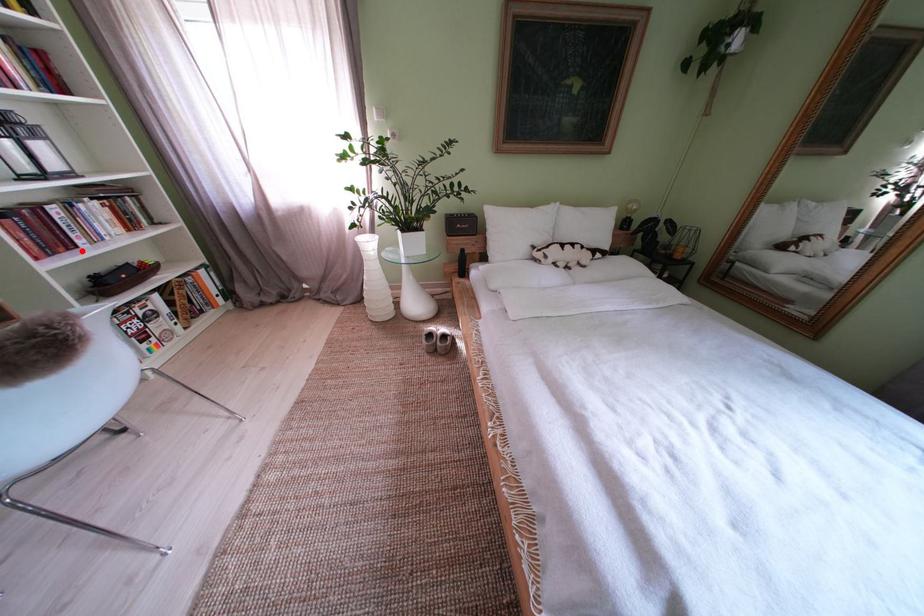
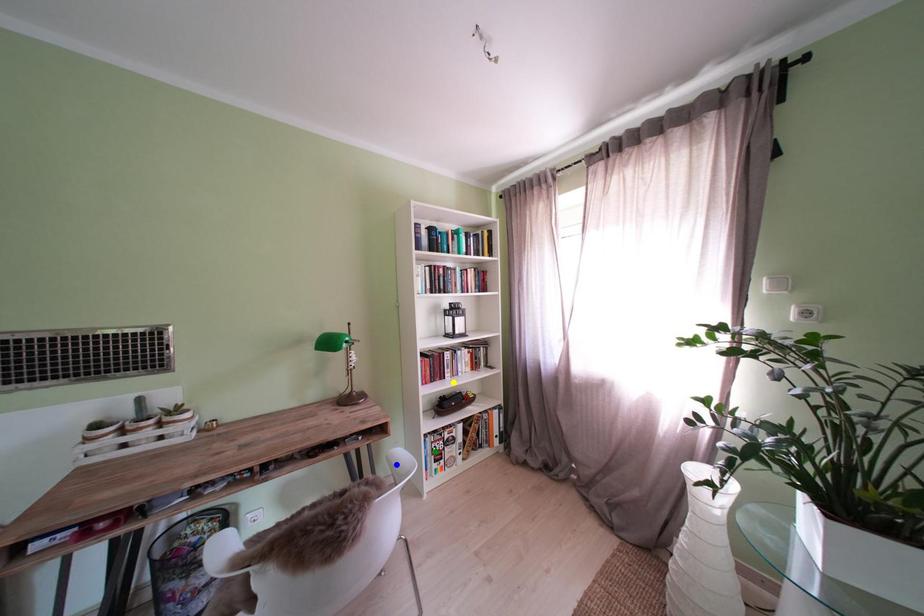
Question: I am providing you with two images of the same scene from different viewpoints. A red point is marked on the first image. You are given multiple points on the second image. Which spot in image 2 lines up with the point in image 1?

Choices:
 (A) blue point
 (B) green point
 (C) yellow point

Answer: (C)